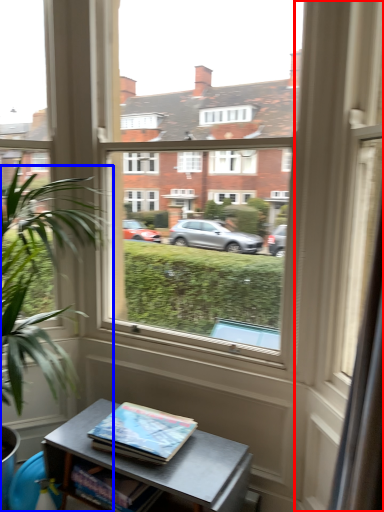
Question: Which object appears closest to the camera in this image, glass door (highlighted by a red box) or houseplant (highlighted by a blue box)?

Choices:
 (A) glass door
 (B) houseplant

Answer: (A)